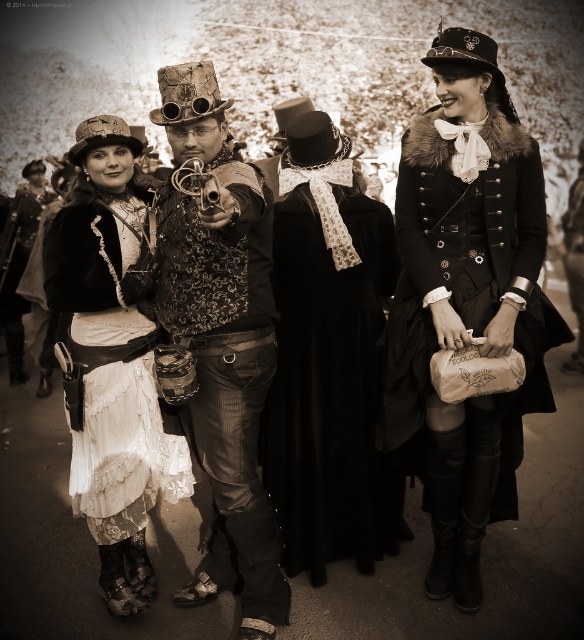
Question: Does steampunk attire at center appear on the right side of matte black vest at center?

Choices:
 (A) yes
 (B) no

Answer: (A)

Question: Among these objects, which one is nearest to the camera?

Choices:
 (A) black velvet dress at center
 (B) matte black vest at center
 (C) fur-trimmed coat at center

Answer: (C)

Question: Which object is positioned closest to the white lace dress at center?

Choices:
 (A) matte black vest at center
 (B) black velvet dress at center

Answer: (B)

Question: Can you confirm if fur-trimmed coat at center is positioned below white lace dress at center?

Choices:
 (A) yes
 (B) no

Answer: (B)

Question: Which point is farther to the camera?

Choices:
 (A) (234, 161)
 (B) (47, 282)

Answer: (B)

Question: Can you confirm if fur-trimmed coat at center is positioned to the left of steampunk attire at center?

Choices:
 (A) no
 (B) yes

Answer: (A)